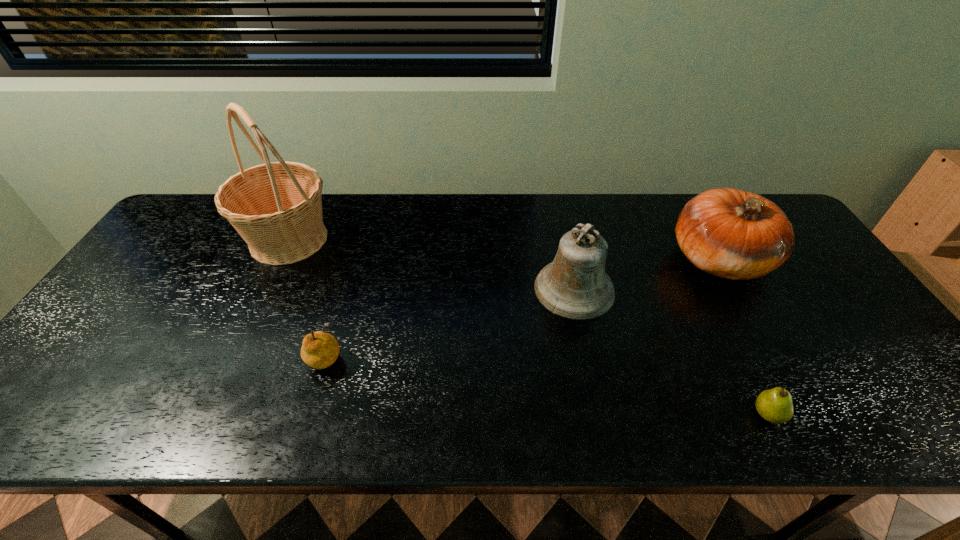
I want to click on vacant space located on the left of the pumpkin, so click(x=613, y=260).

Where is `vacant region located 0.130m on the right of the second nearest object`? vacant region located 0.130m on the right of the second nearest object is located at coordinates (399, 354).

You are a GUI agent. You are given a task and a screenshot of the screen. Output one action in this format:
    pyautogui.click(x=<x>, y=<y>)
    Task: Click on the free space located 0.350m on the left of the nearer pear
    The image size is (960, 540).
    Given the screenshot: What is the action you would take?
    pyautogui.click(x=588, y=414)

This screenshot has width=960, height=540. What are the coordinates of `basket that is at the far edge` in the screenshot? It's located at (276, 207).

At what (x,y) coordinates should I click in order to perform the action: click on pumpkin present at the far edge. Please return your answer as a coordinate pair (x, y). The height and width of the screenshot is (540, 960). Looking at the image, I should click on (729, 233).

Locate an element on the screen. The height and width of the screenshot is (540, 960). object that is at the near edge is located at coordinates (775, 405).

Image resolution: width=960 pixels, height=540 pixels. I want to click on object located in the right edge section of the desktop, so click(x=729, y=233).

You are a GUI agent. You are given a task and a screenshot of the screen. Output one action in this format:
    pyautogui.click(x=<x>, y=<y>)
    Task: Click on the object present at the far right corner
    The height and width of the screenshot is (540, 960).
    Given the screenshot: What is the action you would take?
    pyautogui.click(x=729, y=233)

The height and width of the screenshot is (540, 960). I want to click on vacant area at the far edge of the desktop, so coord(604,205).

At what (x,y) coordinates should I click in order to perform the action: click on vacant space at the near edge. Please return your answer as a coordinate pair (x, y). This screenshot has width=960, height=540. Looking at the image, I should click on (698, 397).